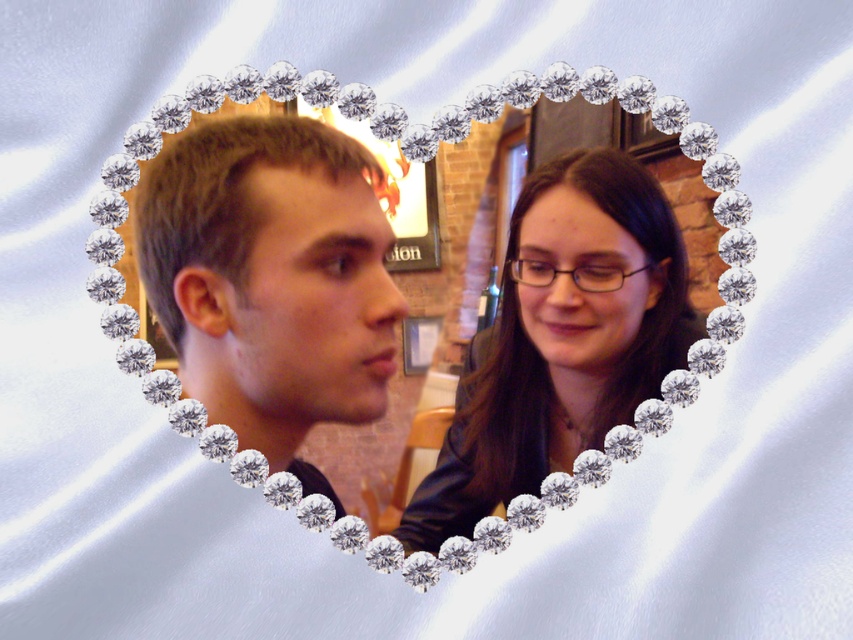
Question: Does matte black hair at center have a smaller size compared to light brown hair at left?

Choices:
 (A) yes
 (B) no

Answer: (B)

Question: Which is nearer to the matte black hair at center?

Choices:
 (A) light brown hair at left
 (B) smooth black hair at center

Answer: (A)

Question: Can you confirm if light brown hair at left is bigger than smooth black hair at center?

Choices:
 (A) no
 (B) yes

Answer: (B)

Question: Considering the real-world distances, which object is farthest from the light brown hair at left?

Choices:
 (A) matte black hair at center
 (B) smooth black hair at center

Answer: (B)

Question: Which object appears closest to the camera in this image?

Choices:
 (A) light brown hair at left
 (B) matte black hair at center
 (C) smooth black hair at center

Answer: (A)

Question: Does matte black hair at center appear under light brown hair at left?

Choices:
 (A) yes
 (B) no

Answer: (A)